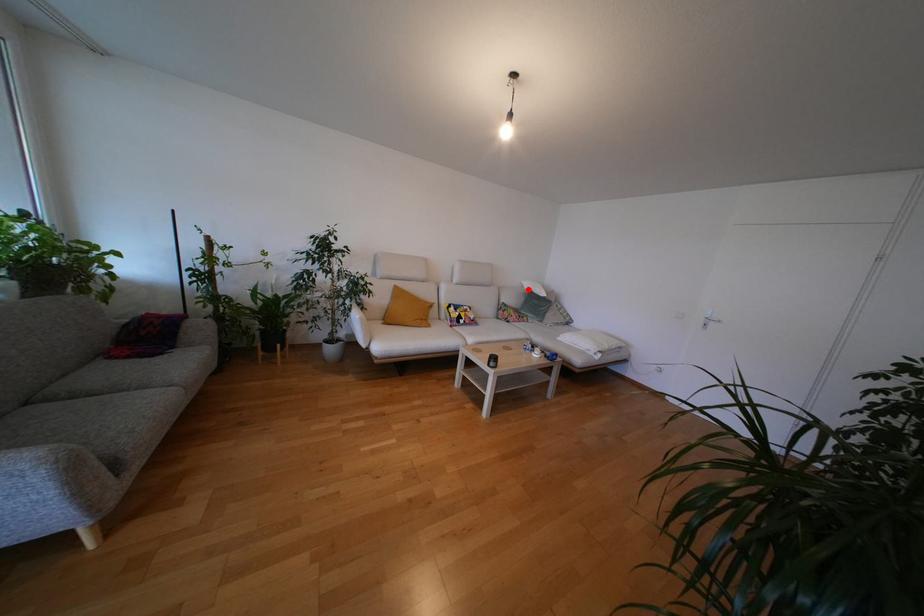
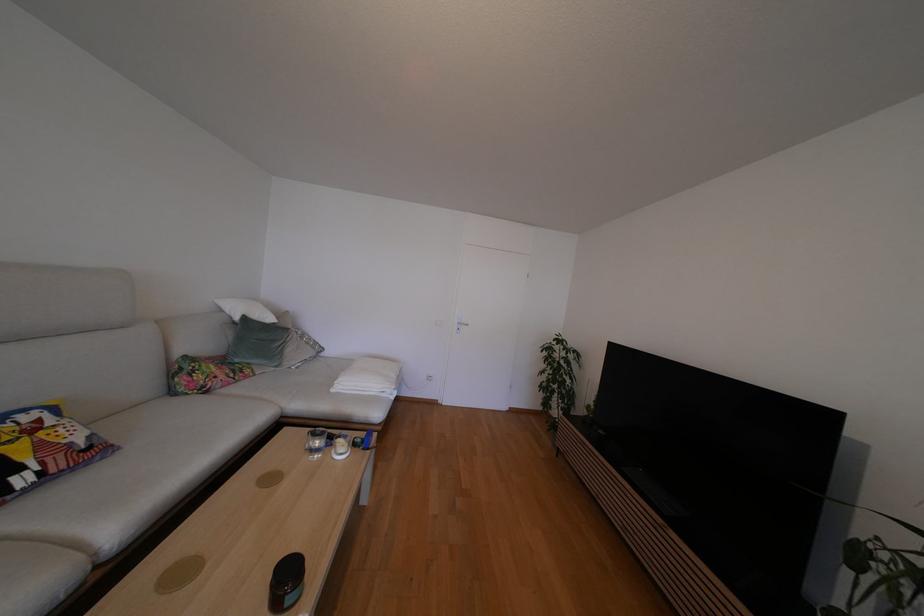
The point at the highlighted location is marked in the first image. Where is the corresponding point in the second image?

(227, 314)